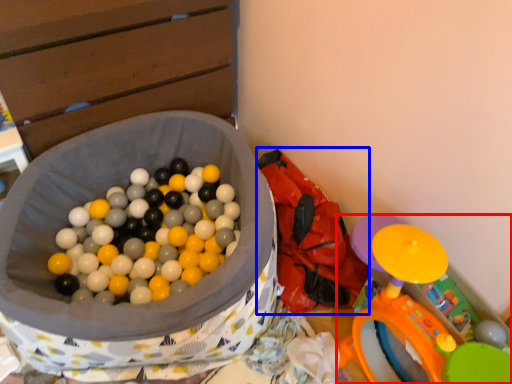
Question: Which object appears closest to the camera in this image, toy (highlighted by a red box) or bean bag chair (highlighted by a blue box)?

Choices:
 (A) toy
 (B) bean bag chair

Answer: (A)